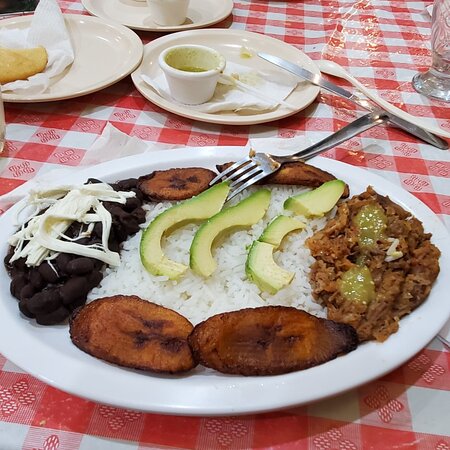
The height and width of the screenshot is (450, 450). What are the coordinates of `drinking glass` in the screenshot? It's located at (444, 42).